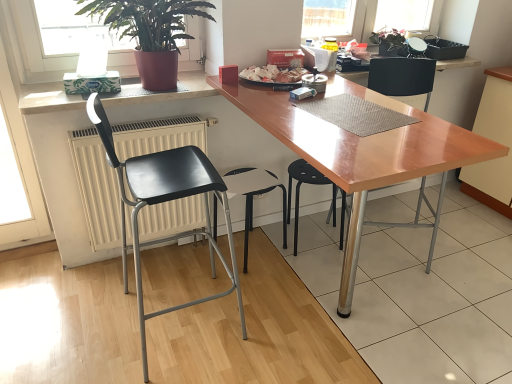
What are the coordinates of `free point below matte black chair at center, arranged as the fourth chair when viewed from the left (from a real-world perspective)` in the screenshot? It's located at (392, 246).